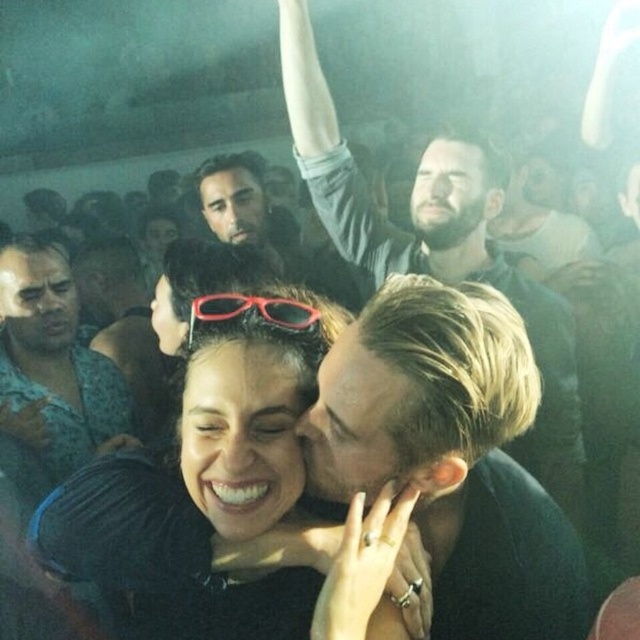
You are a photographer at the event and want to capture a clear shot of the brushed metal shirt at center without the blonde hair at center blocking it. What adjustment should you make to your camera or position?

The blonde hair at center is in front of the brushed metal shirt at center, so to avoid the hair blocking the shirt, you should adjust your position or camera angle to focus on the shirt behind the hair.

From the picture: You are at a social event and want to take a photo of the blonde hair at center and the brushed metal shirt at center. To ensure both are in frame, should you adjust your camera to the left or right?

The blonde hair at center is to the right of brushed metal shirt at center, so you should adjust your camera to the left to capture both in the frame.